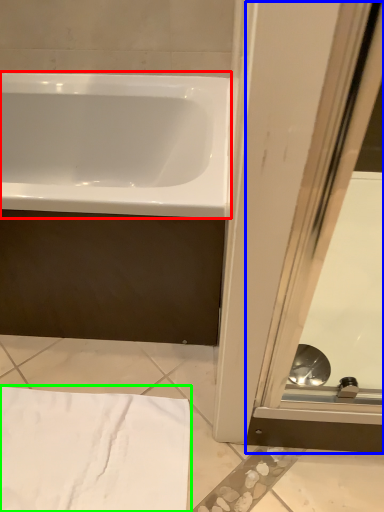
Question: Which is farther away from bathtub (highlighted by a red box)? screen door (highlighted by a blue box) or bath towel (highlighted by a green box)?

Choices:
 (A) screen door
 (B) bath towel

Answer: (B)